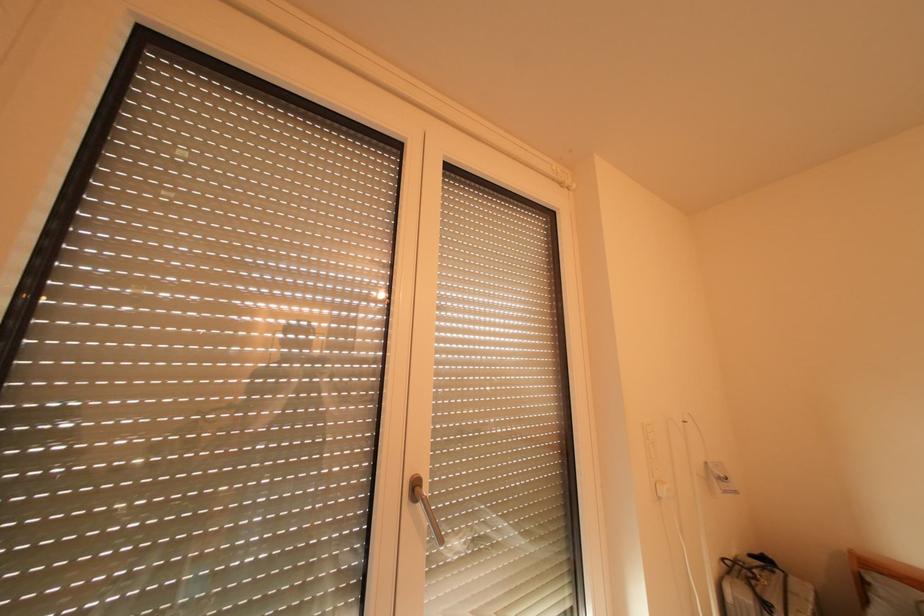
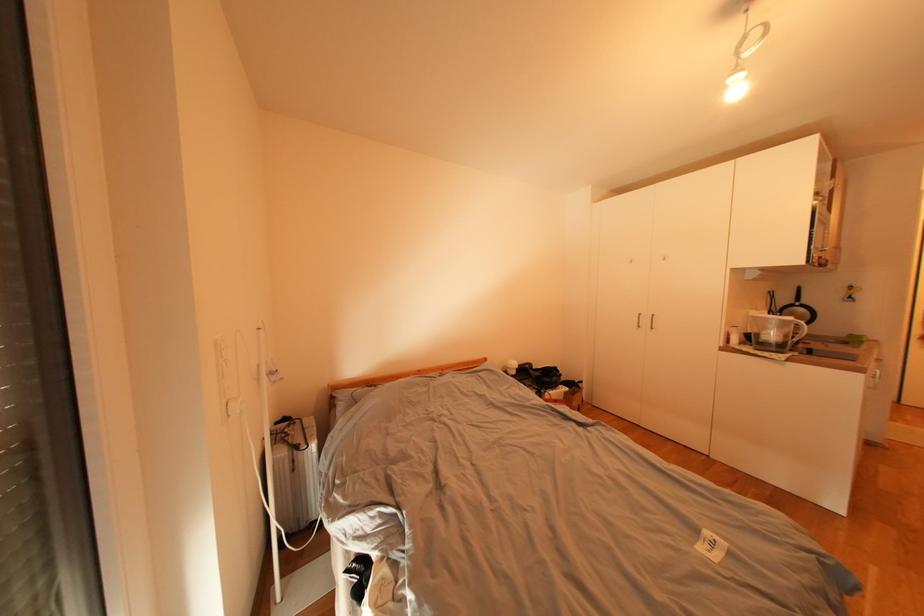
Question: The camera is either moving clockwise (left) or counter-clockwise (right) around the object. The first image is from the beginning of the video and the second image is from the end. Is the camera moving left or right when shooting the video?

Choices:
 (A) Left
 (B) Right

Answer: (A)